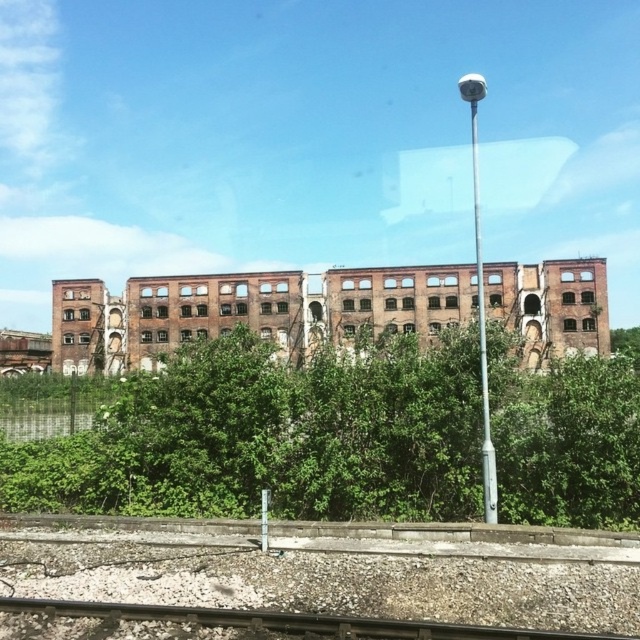
You are standing in front of the industrial building and notice two points marked on the ground. The first point is at coordinates point (x=291, y=488) and the second is at point (x=205, y=611). Which point is closer to you?

Point (x=291, y=488) is further to the viewer than point (x=205, y=611), so the point closer to you is point (x=205, y=611).

You are a photographer trying to capture the brown brick building at center without any obstructions. You notice the green leafy tree at center in the way. Can you move to the left or right to avoid the tree and still see the building?

The green leafy tree at center is in front of the brown brick building at center, so moving to the left or right might allow you to see around the tree and still view the building.

You are a landscape architect designing a new garden around the industrial building. You need to place a new bench exactly halfway between the green leafy tree at center and the smooth metal train track at bottom center. How far apart should you place the bench from each of these two objects?

The green leafy tree at center and smooth metal train track at bottom center are 9.99 meters apart from each other. To place the bench exactly halfway, it should be 4.995 meters away from both objects.